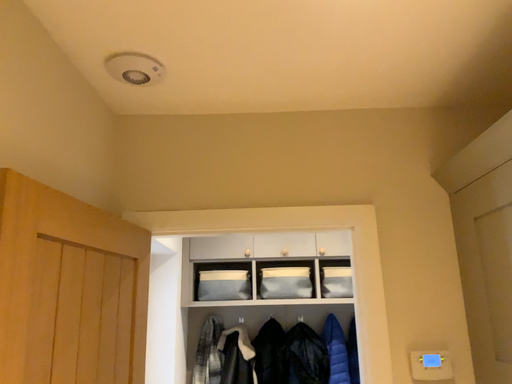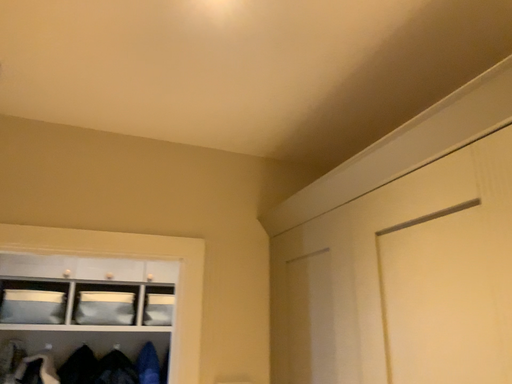
Question: How did the camera likely rotate when shooting the video?

Choices:
 (A) rotated left
 (B) rotated right

Answer: (B)